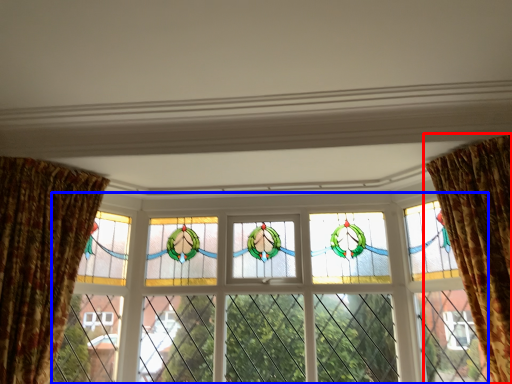
Question: Which point is closer to the camera, curtain (highlighted by a red box) or window (highlighted by a blue box)?

Choices:
 (A) curtain
 (B) window

Answer: (A)